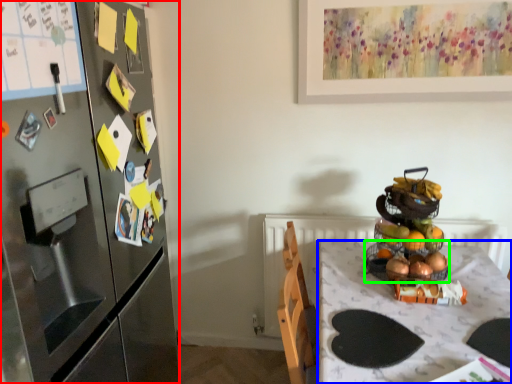
Question: Based on their relative distances, which object is nearer to cabinetry (highlighted by a red box)? Choose from desk (highlighted by a blue box) and basket (highlighted by a green box).

Choices:
 (A) desk
 (B) basket

Answer: (A)